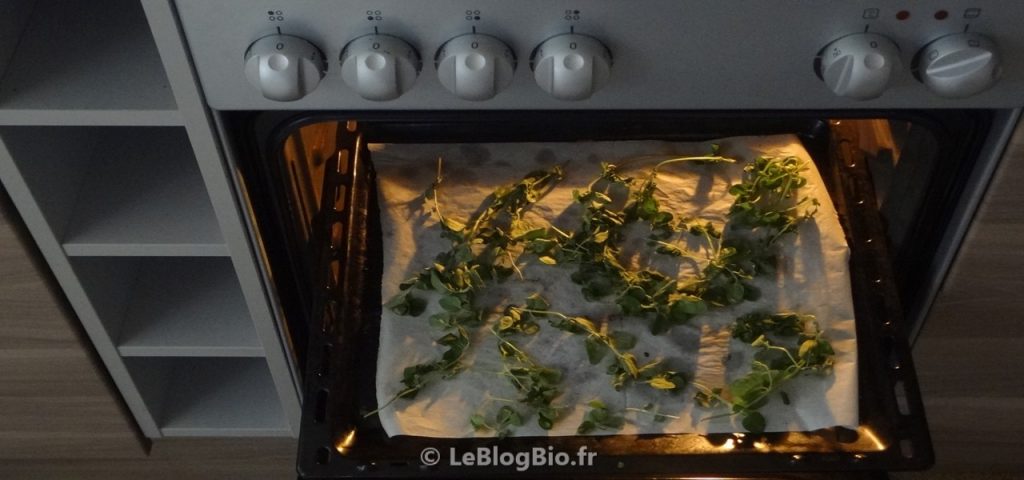
Where is `2nd to bottom shelf`? 2nd to bottom shelf is located at coordinates (189, 303).